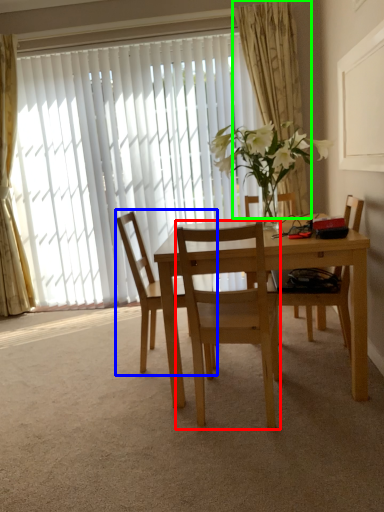
Question: Based on their relative distances, which object is farther from chair (highlighted by a red box)? Choose from chair (highlighted by a blue box) and curtain (highlighted by a green box).

Choices:
 (A) chair
 (B) curtain

Answer: (B)